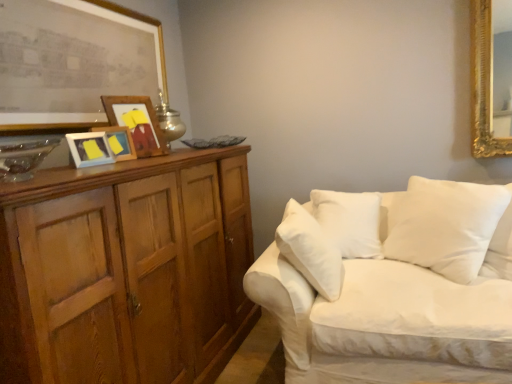
Describe the element at coordinates (73, 59) in the screenshot. Image resolution: width=512 pixels, height=384 pixels. I see `wooden picture frame at upper left, the fourth picture frame in the back-to-front sequence` at that location.

This screenshot has width=512, height=384. What are the coordinates of `yellow paper at center, which ranks as the second picture frame in back-to-front order` in the screenshot? It's located at (119, 142).

Find the location of a particular element. white soft cushion at right is located at coordinates (447, 226).

What do you see at coordinates (137, 123) in the screenshot? The height and width of the screenshot is (384, 512). I see `wooden picture frame at upper left, which appears as the 1th picture frame when viewed from the back` at bounding box center [137, 123].

What do you see at coordinates (126, 270) in the screenshot? I see `wooden cabinet at left` at bounding box center [126, 270].

This screenshot has height=384, width=512. What are the coordinates of `metallic silver table lamp at upper left` in the screenshot? It's located at (169, 121).

Image resolution: width=512 pixels, height=384 pixels. What do you see at coordinates (89, 149) in the screenshot?
I see `wooden picture frame at left, the second picture frame when ordered from front to back` at bounding box center [89, 149].

The width and height of the screenshot is (512, 384). Identify the location of wooden picture frame at upper left, which is counted as the first picture frame, starting from the front. (73, 59).

Which object is wider, wooden cabinet at left or white soft cushion at right?

Wider between the two is wooden cabinet at left.

Who is shorter, wooden cabinet at left or white soft cushion at right?

white soft cushion at right is shorter.

Is wooden cabinet at left positioned in front of white soft cushion at right?

Yes.

Is wooden cabinet at left in contact with white soft cushion at right?

There is a gap between wooden cabinet at left and white soft cushion at right.

Consider the image. Which of these two, wooden cabinet at left or metallic silver table lamp at upper left, is thinner?

Thinner between the two is metallic silver table lamp at upper left.

Does point (139, 373) lie behind point (159, 112)?

No, it is not.

Does wooden cabinet at left have a smaller size compared to metallic silver table lamp at upper left?

Actually, wooden cabinet at left might be larger than metallic silver table lamp at upper left.

What's the angular difference between wooden cabinet at left and metallic silver table lamp at upper left's facing directions?

0.000296 degrees.

Measure the distance from wooden picture frame at left, placed as the 3th picture frame when sorted from back to front, to wooden picture frame at upper left, which is the 4th picture frame in front-to-back order.

wooden picture frame at left, placed as the 3th picture frame when sorted from back to front, is 11.95 inches away from wooden picture frame at upper left, which is the 4th picture frame in front-to-back order.

Is wooden picture frame at left, placed as the 3th picture frame when sorted from back to front, positioned with its back to wooden picture frame at upper left, which is the 4th picture frame in front-to-back order?

No, wooden picture frame at left, placed as the 3th picture frame when sorted from back to front,'s orientation is not away from wooden picture frame at upper left, which is the 4th picture frame in front-to-back order.

From a real-world perspective, is wooden picture frame at left, the second picture frame when ordered from front to back, beneath wooden picture frame at upper left, which appears as the 1th picture frame when viewed from the back?

Correct, in the physical world, wooden picture frame at left, the second picture frame when ordered from front to back, is lower than wooden picture frame at upper left, which appears as the 1th picture frame when viewed from the back.

Does point (96, 136) come closer to viewer compared to point (156, 148)?

Yes.

Which of these two, yellow paper at center, the third picture frame from the front, or wooden picture frame at upper left, which is the 4th picture frame in front-to-back order, is smaller?

With smaller size is yellow paper at center, the third picture frame from the front.

Is yellow paper at center, the third picture frame from the front, turned away from wooden picture frame at upper left, which appears as the 1th picture frame when viewed from the back?

No, yellow paper at center, the third picture frame from the front, is not facing the opposite direction of wooden picture frame at upper left, which appears as the 1th picture frame when viewed from the back.

Is point (132, 153) closer or farther from the camera than point (122, 110)?

Point (132, 153) is closer to the camera than point (122, 110).

Does yellow paper at center, which ranks as the second picture frame in back-to-front order, have a lesser height compared to wooden cabinet at left?

Correct, yellow paper at center, which ranks as the second picture frame in back-to-front order, is not as tall as wooden cabinet at left.

Who is more distant, yellow paper at center, which ranks as the second picture frame in back-to-front order, or wooden cabinet at left?

→ yellow paper at center, which ranks as the second picture frame in back-to-front order, is further away from the camera.

From a real-world perspective, is yellow paper at center, which ranks as the second picture frame in back-to-front order, physically below wooden cabinet at left?

No, from a real-world perspective, yellow paper at center, which ranks as the second picture frame in back-to-front order, is not below wooden cabinet at left.

Does yellow paper at center, which ranks as the second picture frame in back-to-front order, touch wooden cabinet at left?

No, yellow paper at center, which ranks as the second picture frame in back-to-front order, is not beside wooden cabinet at left.

Considering the positions of point (469, 218) and point (160, 124), is point (469, 218) closer or farther from the camera than point (160, 124)?

Point (469, 218) is positioned closer to the camera compared to point (160, 124).

From the picture: Considering the relative positions of white soft cushion at right and metallic silver table lamp at upper left in the image provided, is white soft cushion at right to the left or to the right of metallic silver table lamp at upper left?

From the image, it's evident that white soft cushion at right is to the right of metallic silver table lamp at upper left.

Which of these two, wooden cabinet at left or white fabric couch at right, is wider?

Wider between the two is white fabric couch at right.

From the image's perspective, which one is positioned lower, wooden cabinet at left or white fabric couch at right?

white fabric couch at right is shown below in the image.

You are a GUI agent. You are given a task and a screenshot of the screen. Output one action in this format:
    pyautogui.click(x=<x>, y=<y>)
    Task: Click on the cabinetry located in front of the white fabric couch at right
    This screenshot has width=512, height=384.
    Given the screenshot: What is the action you would take?
    pyautogui.click(x=126, y=270)

Considering their positions, is wooden cabinet at left located in front of or behind white fabric couch at right?

In the image, wooden cabinet at left appears in front of white fabric couch at right.

The height and width of the screenshot is (384, 512). What are the coordinates of `pillow located above the wooden cabinet at left (from the image's perspective)` in the screenshot? It's located at (447, 226).

Where is `cabinetry below the metallic silver table lamp at upper left (from a real-world perspective)`? cabinetry below the metallic silver table lamp at upper left (from a real-world perspective) is located at coordinates (126, 270).

Based on their spatial positions, is wooden picture frame at upper left, which appears as the 1th picture frame when viewed from the back, or wooden cabinet at left closer to yellow paper at center, which ranks as the second picture frame in back-to-front order?

wooden picture frame at upper left, which appears as the 1th picture frame when viewed from the back.

Estimate the real-world distances between objects in this image. Which object is further from wooden picture frame at upper left, which appears as the 1th picture frame when viewed from the back, wooden picture frame at upper left, the fourth picture frame in the back-to-front sequence, or yellow paper at center, which ranks as the second picture frame in back-to-front order?

wooden picture frame at upper left, the fourth picture frame in the back-to-front sequence, is positioned further to the anchor wooden picture frame at upper left, which appears as the 1th picture frame when viewed from the back.

Considering their positions, is white soft cushion at right positioned further to wooden cabinet at left than wooden picture frame at left, the second picture frame when ordered from front to back?

Based on the image, white soft cushion at right appears to be further to wooden cabinet at left.

When comparing their distances from wooden picture frame at left, the second picture frame when ordered from front to back, does white fabric couch at right or white soft cushion at right seem further?

The object further to wooden picture frame at left, the second picture frame when ordered from front to back, is white soft cushion at right.

Based on their spatial positions, is white fabric couch at right or wooden picture frame at upper left, which is the 4th picture frame in front-to-back order, further from wooden cabinet at left?

Based on the image, white fabric couch at right appears to be further to wooden cabinet at left.

Based on their spatial positions, is metallic silver table lamp at upper left or white fabric couch at right further from yellow paper at center, which ranks as the second picture frame in back-to-front order?

white fabric couch at right is positioned further to the anchor yellow paper at center, which ranks as the second picture frame in back-to-front order.

When comparing their distances from yellow paper at center, which ranks as the second picture frame in back-to-front order, does wooden picture frame at upper left, which is counted as the first picture frame, starting from the front, or white soft cushion at right seem further?

The object further to yellow paper at center, which ranks as the second picture frame in back-to-front order, is white soft cushion at right.

From the image, which object appears to be nearer to metallic silver table lamp at upper left, white soft cushion at right or wooden cabinet at left?

wooden cabinet at left lies closer to metallic silver table lamp at upper left than the other object.

At what (x,y) coordinates should I click in order to perform the action: click on table lamp between wooden cabinet at left and white fabric couch at right. Please return your answer as a coordinate pair (x, y). Looking at the image, I should click on (169, 121).

This screenshot has height=384, width=512. Identify the location of picture frame positioned between yellow paper at center, the third picture frame from the front, and metallic silver table lamp at upper left from near to far. (137, 123).

Locate an element on the screen. studio couch between wooden picture frame at upper left, which is the 4th picture frame in front-to-back order, and white soft cushion at right is located at coordinates (395, 289).

You are a GUI agent. You are given a task and a screenshot of the screen. Output one action in this format:
    pyautogui.click(x=<x>, y=<y>)
    Task: Click on the studio couch between yellow paper at center, which ranks as the second picture frame in back-to-front order, and white soft cushion at right, in the horizontal direction
    This screenshot has width=512, height=384.
    Given the screenshot: What is the action you would take?
    pyautogui.click(x=395, y=289)